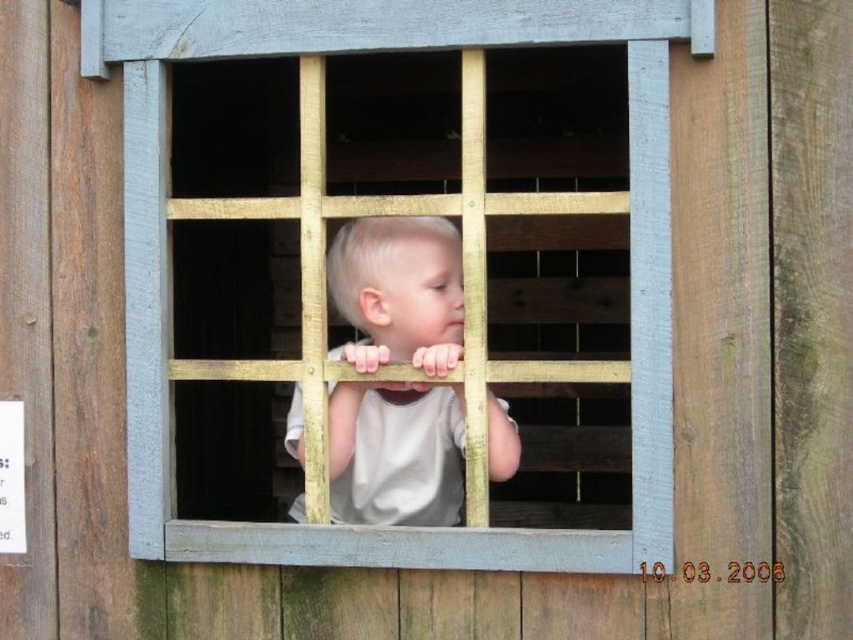
You are a painter standing in front of the window with wooden bars. You want to paint the wooden bars at center and the light beige fabric shirt at center. Which object should you focus on first to capture their relative positions accurately?

You should focus on painting the wooden bars at center first since they are closer to the viewer than the light beige fabric shirt at center, so they should appear in front in the painting.

You are a tailor measuring the light beige fabric shirt at center to ensure it fits through a narrow doorway. The doorway has a width equal to the wooden bars at center. Will the shirt fit through the doorway?

The wooden bars at center are wider than the light beige fabric shirt at center. Since the doorway has the same width as the wooden bars, the shirt will fit through the doorway.